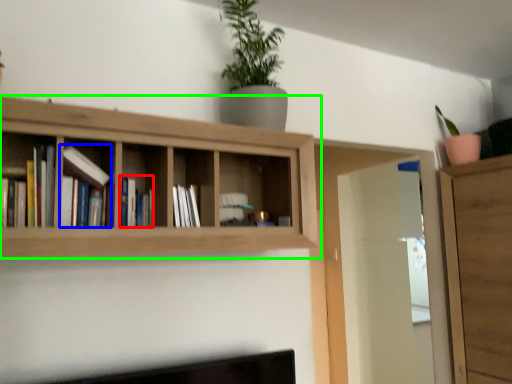
Question: Which is nearer to the book (highlighted by a red box)? book (highlighted by a blue box) or shelf (highlighted by a green box).

Choices:
 (A) book
 (B) shelf

Answer: (A)